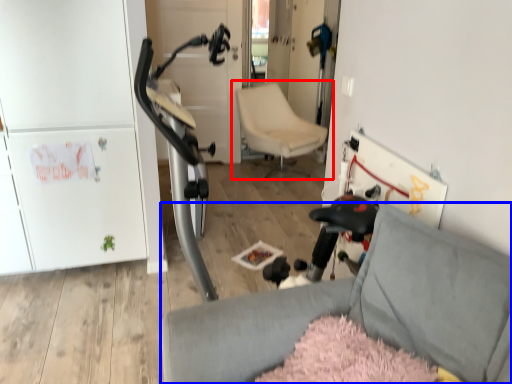
Question: Which object is closer to the camera taking this photo, chair (highlighted by a red box) or chair (highlighted by a blue box)?

Choices:
 (A) chair
 (B) chair

Answer: (B)